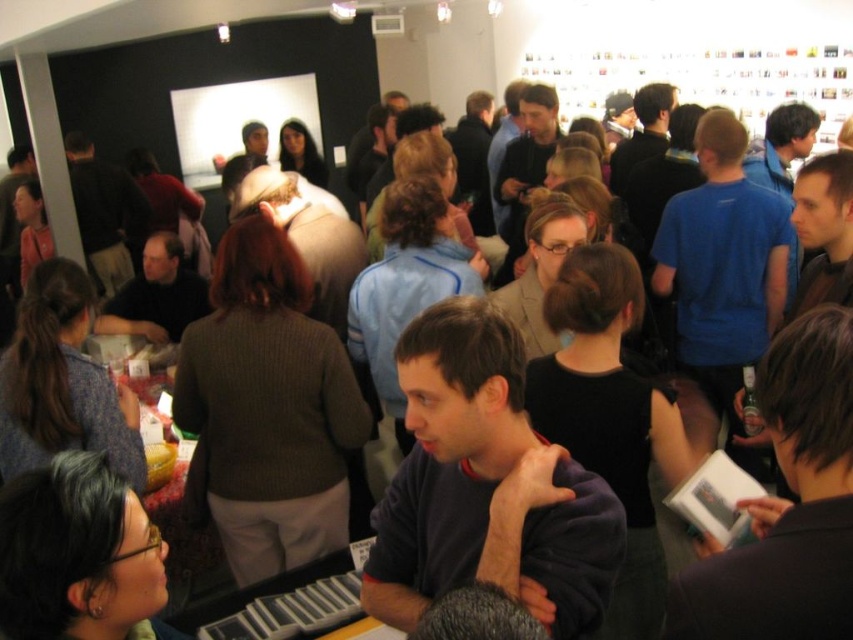
Which is more to the right, dark brown sweater at center or light brown sweater at center?

From the viewer's perspective, light brown sweater at center appears more on the right side.

Locate an element on the screen. The image size is (853, 640). dark brown sweater at center is located at coordinates [105, 212].

I want to click on dark brown sweater at center, so click(x=105, y=212).

Which is more to the left, dark blue fleece at center or dark brown sweater at center?

dark brown sweater at center

Can you confirm if dark blue fleece at center is taller than dark brown sweater at center?

Incorrect, dark blue fleece at center's height is not larger of dark brown sweater at center's.

Does point (474, 570) lie in front of point (102, 225)?

Yes.

Identify the location of dark blue fleece at center. The image size is (853, 640). (483, 483).

Is point (686, 284) positioned in front of point (131, 186)?

Yes, point (686, 284) is closer to viewer.

Can you confirm if blue cotton shirt at right is wider than dark brown sweater at center?

No.

Between point (665, 276) and point (74, 160), which one is positioned behind?

The point (74, 160) is more distant.

Locate an element on the screen. blue cotton shirt at right is located at coordinates (723, 264).